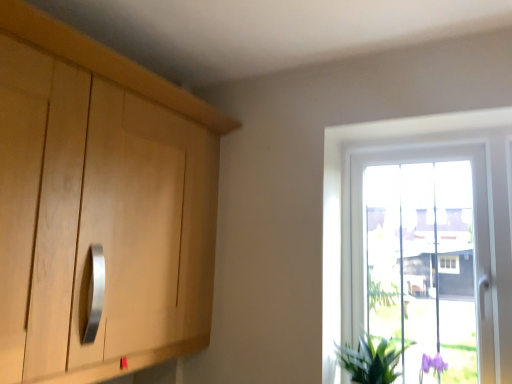
The width and height of the screenshot is (512, 384). I want to click on green leafy plant at lower right, so click(370, 361).

The height and width of the screenshot is (384, 512). Describe the element at coordinates (370, 361) in the screenshot. I see `green leafy plant at lower right` at that location.

Find the location of `transparent glass window at right`. transparent glass window at right is located at coordinates (349, 202).

What do you see at coordinates (349, 202) in the screenshot? I see `transparent glass window at right` at bounding box center [349, 202].

Where is `green leafy plant at lower right`? green leafy plant at lower right is located at coordinates (370, 361).

Considering the positions of objects green leafy plant at lower right and transparent glass window at right in the image provided, who is more to the right, green leafy plant at lower right or transparent glass window at right?

transparent glass window at right.

Relative to transparent glass window at right, is green leafy plant at lower right in front or behind?

green leafy plant at lower right is in front of transparent glass window at right.

Is point (373, 368) closer to viewer compared to point (347, 142)?

That is True.

From the image's perspective, is green leafy plant at lower right above or below transparent glass window at right?

From the image's perspective, green leafy plant at lower right appears below transparent glass window at right.

From a real-world perspective, which is physically above, green leafy plant at lower right or transparent glass window at right?

transparent glass window at right, from a real-world perspective.

Considering the sizes of objects green leafy plant at lower right and transparent glass window at right in the image provided, who is thinner, green leafy plant at lower right or transparent glass window at right?

transparent glass window at right.

In terms of height, does green leafy plant at lower right look taller or shorter compared to transparent glass window at right?

green leafy plant at lower right is shorter than transparent glass window at right.

In the scene shown: Who is bigger, green leafy plant at lower right or transparent glass window at right?

transparent glass window at right.

Is transparent glass window at right inside green leafy plant at lower right?

No, transparent glass window at right is not a part of green leafy plant at lower right.

Is green leafy plant at lower right positioned far away from transparent glass window at right?

No, there isn't a large distance between green leafy plant at lower right and transparent glass window at right.

Is green leafy plant at lower right facing towards transparent glass window at right?

No.

Can you tell me how much green leafy plant at lower right and transparent glass window at right differ in facing direction?

The facing directions of green leafy plant at lower right and transparent glass window at right are 0.293 degrees apart.

This screenshot has width=512, height=384. I want to click on houseplant located underneath the transparent glass window at right (from a real-world perspective), so click(370, 361).

Between transparent glass window at right and green leafy plant at lower right, which one appears on the right side from the viewer's perspective?

Positioned to the right is transparent glass window at right.

Considering their positions, is transparent glass window at right located in front of or behind green leafy plant at lower right?

transparent glass window at right is behind green leafy plant at lower right.

Which is in front, point (328, 280) or point (393, 376)?

Positioned in front is point (393, 376).

From the image's perspective, would you say transparent glass window at right is shown under green leafy plant at lower right?

No.

From a real-world perspective, relative to green leafy plant at lower right, is transparent glass window at right vertically above or below?

transparent glass window at right is above green leafy plant at lower right.

Which object is wider, transparent glass window at right or green leafy plant at lower right?

green leafy plant at lower right is wider.

Considering the sizes of objects transparent glass window at right and green leafy plant at lower right in the image provided, who is shorter, transparent glass window at right or green leafy plant at lower right?

green leafy plant at lower right is shorter.

In terms of size, does transparent glass window at right appear bigger or smaller than green leafy plant at lower right?

In the image, transparent glass window at right appears to be larger than green leafy plant at lower right.

Is transparent glass window at right spatially inside green leafy plant at lower right, or outside of it?

transparent glass window at right cannot be found inside green leafy plant at lower right.

In the scene shown: Are transparent glass window at right and green leafy plant at lower right located far from each other?

No, there isn't a large distance between transparent glass window at right and green leafy plant at lower right.

Does transparent glass window at right turn towards green leafy plant at lower right?

Yes, transparent glass window at right is oriented towards green leafy plant at lower right.

Where is `houseplant located on the left of transparent glass window at right`? This screenshot has height=384, width=512. houseplant located on the left of transparent glass window at right is located at coordinates (370, 361).

At what (x,y) coordinates should I click in order to perform the action: click on window that appears above the green leafy plant at lower right (from the image's perspective). Please return your answer as a coordinate pair (x, y). This screenshot has width=512, height=384. Looking at the image, I should click on (349, 202).

You are a GUI agent. You are given a task and a screenshot of the screen. Output one action in this format:
    pyautogui.click(x=<x>, y=<y>)
    Task: Click on the window that is behind the green leafy plant at lower right
    
    Given the screenshot: What is the action you would take?
    pyautogui.click(x=349, y=202)